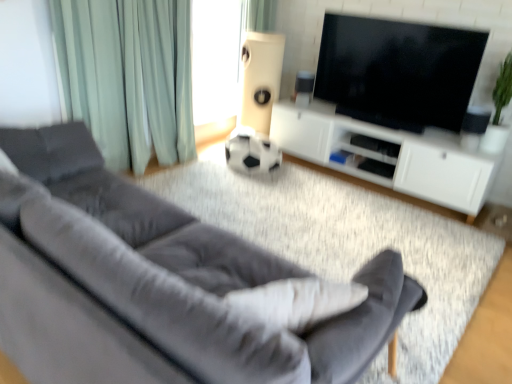
Where is `vacant area that is in front of white plastic speaker at upper center, arranged as the first speaker when viewed from the right`? Image resolution: width=512 pixels, height=384 pixels. vacant area that is in front of white plastic speaker at upper center, arranged as the first speaker when viewed from the right is located at coordinates (306, 108).